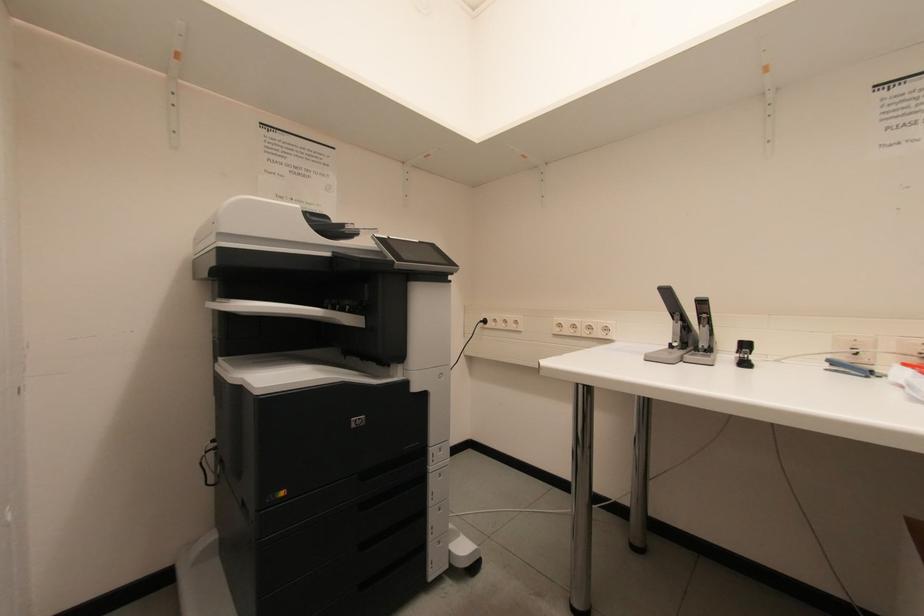
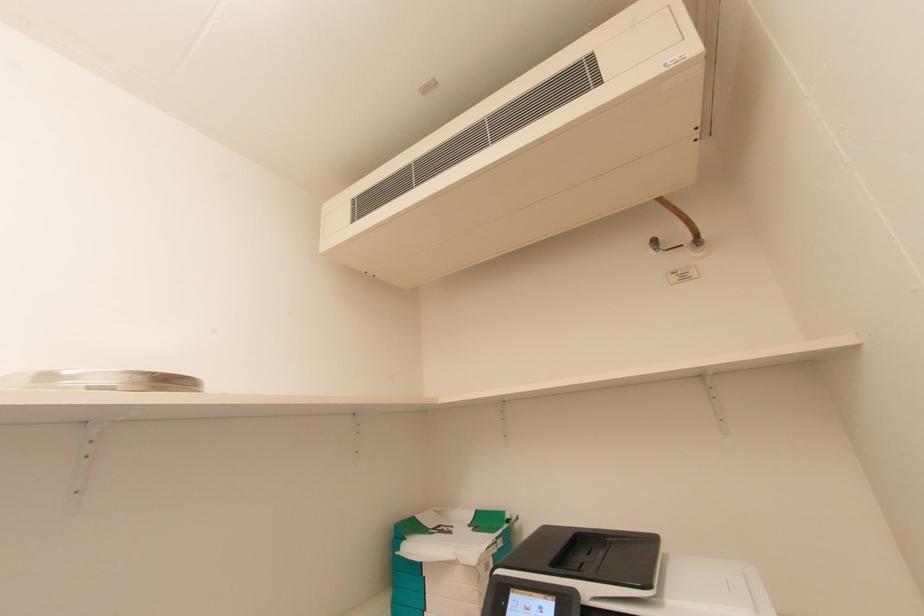
First-person continuous shooting, in which direction is the camera rotating?

The rotation direction of the camera is right-up.